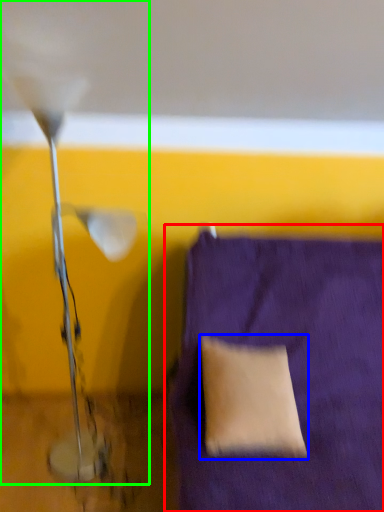
Question: Which object is positioned closest to furniture (highlighted by a red box)? Select from pillow (highlighted by a blue box) and lamp (highlighted by a green box).

Choices:
 (A) pillow
 (B) lamp

Answer: (A)